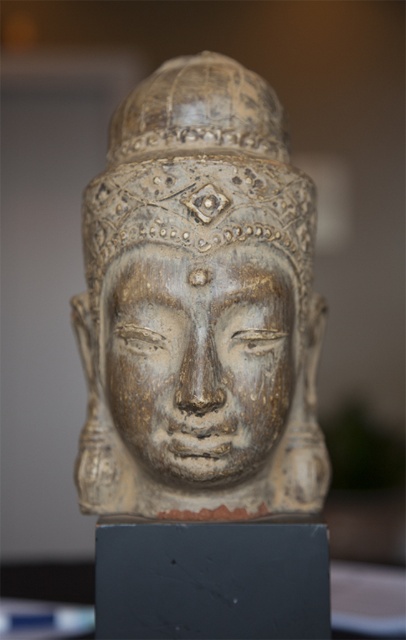
You are an art conservator examining the golden carved head at center and the golden carved face at center. Which one is positioned to the right of the other?

The golden carved head at center is positioned to the right of the golden carved face at center.

You are an art conservator examining the golden carved head at center and the golden carved face at center displayed on a dark stand. Which object would require a larger protective covering to fully cover it?

The golden carved head at center requires a larger protective covering because it is bigger than the golden carved face at center.

You are an archaeologist examining the stone head sculpture. You notice a specific point marked at coordinates (200,307). What object is located at this point?

The golden carved head at center is located at point (200,307).